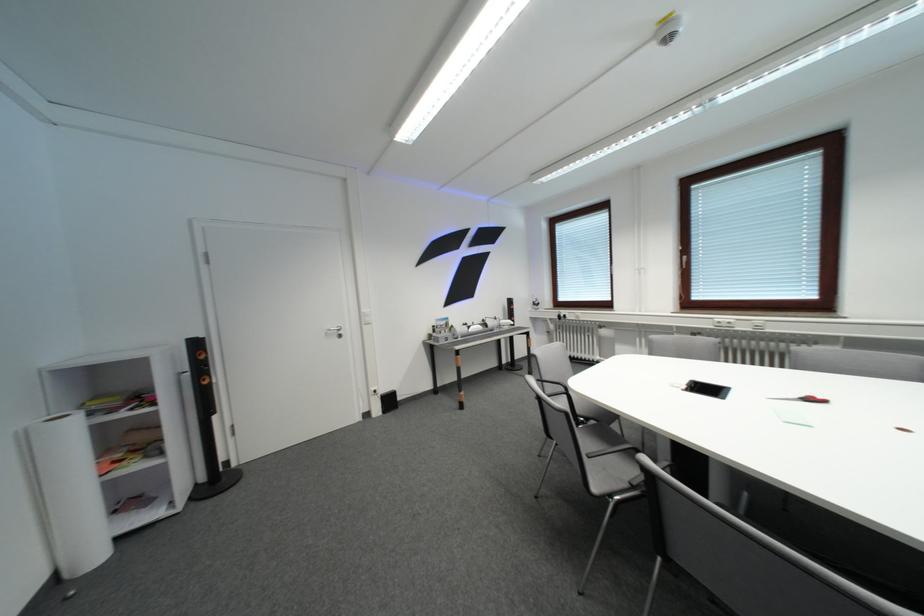
The height and width of the screenshot is (616, 924). What do you see at coordinates (366, 317) in the screenshot?
I see `a white light switch` at bounding box center [366, 317].